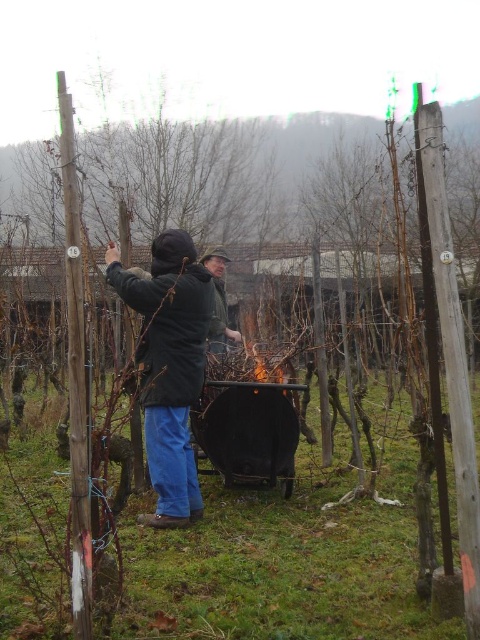
Question: Can you confirm if dark blue jacket at center is smaller than green matte jacket at center?

Choices:
 (A) no
 (B) yes

Answer: (A)

Question: Among these points, which one is farthest from the camera?

Choices:
 (A) (231, 330)
 (B) (155, 486)

Answer: (A)

Question: Does dark blue jacket at center have a greater width compared to green matte jacket at center?

Choices:
 (A) no
 (B) yes

Answer: (B)

Question: Can you confirm if dark blue jacket at center is positioned to the left of green matte jacket at center?

Choices:
 (A) no
 (B) yes

Answer: (B)